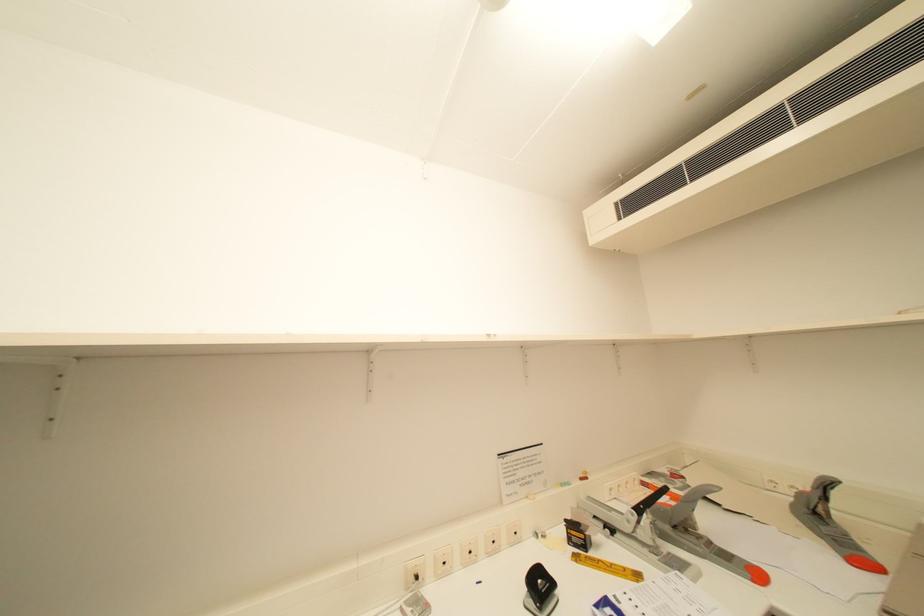
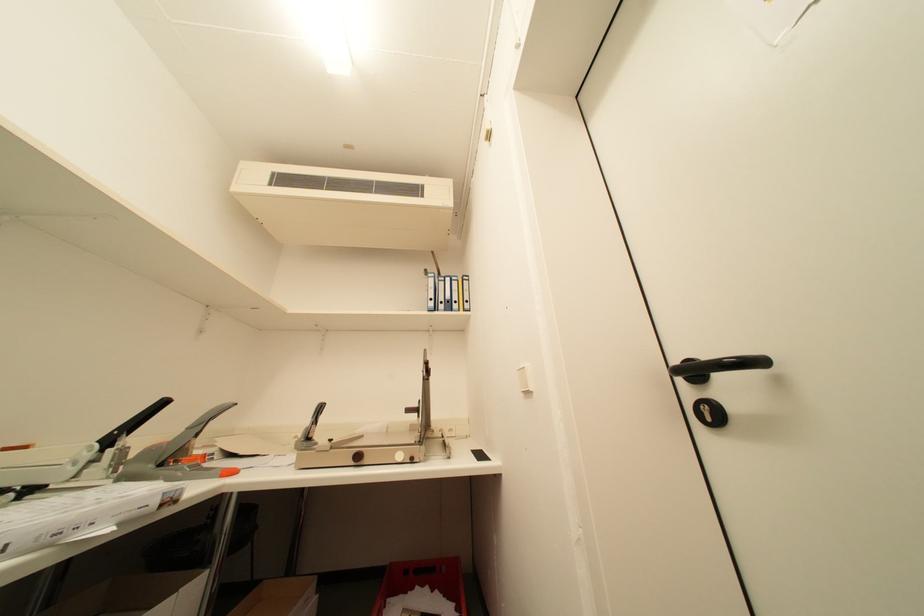
Based on the photo, based on the continuous images, in which direction is the camera rotating?

The camera's rotation is toward right-up.